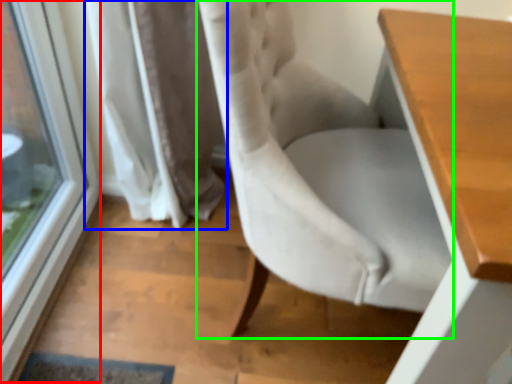
Question: Which object is positioned farthest from window (highlighted by a red box)? Select from curtain (highlighted by a blue box) and chair (highlighted by a green box).

Choices:
 (A) curtain
 (B) chair

Answer: (B)